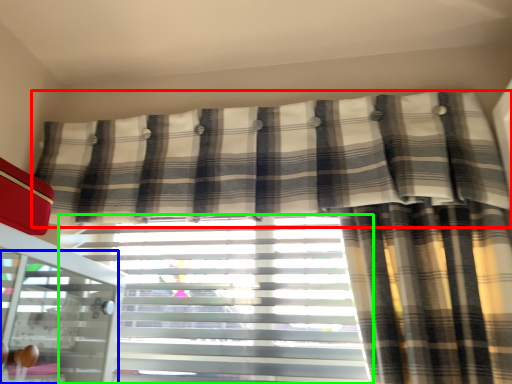
Question: Which object is the closest to the curtain (highlighted by a red box)? Choose among these: screen door (highlighted by a blue box) or window blind (highlighted by a green box).

Choices:
 (A) screen door
 (B) window blind

Answer: (B)